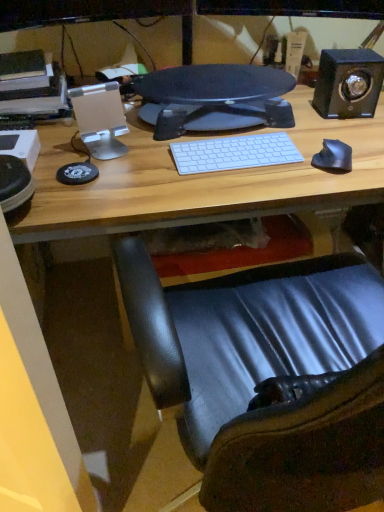
Question: Is shiny black mouse at right wider or thinner than black matte speaker at upper right?

Choices:
 (A) thin
 (B) wide

Answer: (A)

Question: Is shiny black mouse at right in front of or behind black matte speaker at upper right in the image?

Choices:
 (A) behind
 (B) front

Answer: (B)

Question: Which object is the closest to the black textured monitor at center?

Choices:
 (A) black matte speaker at upper right
 (B) shiny black mouse at right
 (C) white matte keyboard at center

Answer: (C)

Question: Which is nearer to the black textured monitor at center?

Choices:
 (A) shiny black mouse at right
 (B) white matte keyboard at center
 (C) black matte speaker at upper right

Answer: (B)